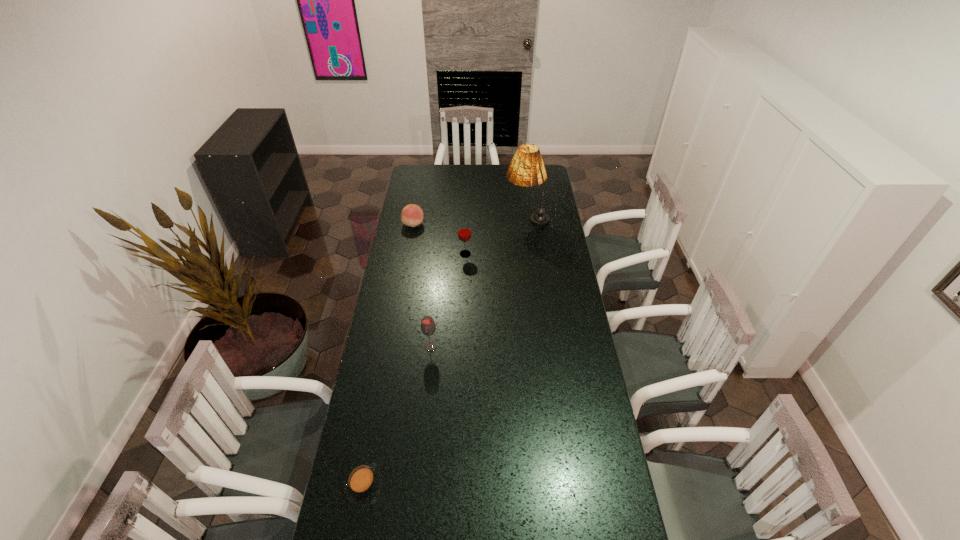
Find the location of a particular element. The image size is (960, 540). free point between the nearest object and the right glass drink container is located at coordinates (415, 370).

You are a GUI agent. You are given a task and a screenshot of the screen. Output one action in this format:
    pyautogui.click(x=<x>, y=<y>)
    Task: Click on the vacant space that is in between the right glass drink container and the peach
    
    Given the screenshot: What is the action you would take?
    pyautogui.click(x=440, y=239)

This screenshot has height=540, width=960. In order to click on the fourth closest object to the shortest object in this screenshot , I will do `click(526, 169)`.

The height and width of the screenshot is (540, 960). What are the coordinates of `object identified as the third closest to the shortest object` in the screenshot? It's located at (412, 215).

Locate an element on the screen. The height and width of the screenshot is (540, 960). vacant area in the image that satisfies the following two spatial constraints: 1. on the back side of the cappuccino; 2. on the right side of the nearer glass drink container is located at coordinates (390, 346).

What are the coordinates of `free spot that satisfies the following two spatial constraints: 1. on the front side of the farther glass drink container; 2. on the left side of the fourth tallest object` in the screenshot? It's located at (408, 254).

Locate an element on the screen. The width and height of the screenshot is (960, 540). vacant space that satisfies the following two spatial constraints: 1. on the front-facing side of the lampshade; 2. on the front side of the fourth tallest object is located at coordinates (527, 224).